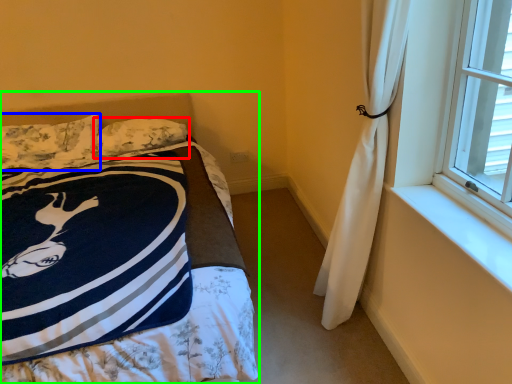
Question: Which object is positioned farthest from pillow (highlighted by a red box)? Select from pillow (highlighted by a blue box) and bed (highlighted by a green box).

Choices:
 (A) pillow
 (B) bed

Answer: (A)